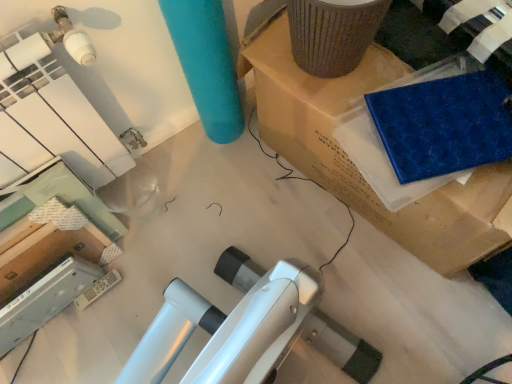
In order to face blue sponge at upper right, should I rotate leftwards or rightwards?

Rotate your view right by about 24.648°.

What do you see at coordinates (444, 124) in the screenshot? The image size is (512, 384). I see `blue sponge at upper right` at bounding box center [444, 124].

Where is `blue sponge at upper right`? blue sponge at upper right is located at coordinates (444, 124).

Measure the distance between point (x=333, y=154) and camera.

Point (x=333, y=154) and camera are 3.73 feet apart.

Locate an element on the screen. This screenshot has width=512, height=384. blue rubber mat at upper right is located at coordinates (352, 162).

Measure the distance between blue rubber mat at upper right and camera.

The depth of blue rubber mat at upper right is 34.29 inches.

What do you see at coordinates (352, 162) in the screenshot? This screenshot has height=384, width=512. I see `blue rubber mat at upper right` at bounding box center [352, 162].

Find the location of a particular element. Image resolution: width=512 pixels, height=384 pixels. blue sponge at upper right is located at coordinates (444, 124).

Which object is positioned more to the left, blue sponge at upper right or blue rubber mat at upper right?

blue sponge at upper right.

Considering the relative positions of blue sponge at upper right and blue rubber mat at upper right in the image provided, is blue sponge at upper right behind blue rubber mat at upper right?

Yes, blue sponge at upper right is further from the viewer.

Considering the points (482, 78) and (419, 213), which point is in front, point (482, 78) or point (419, 213)?

The point (482, 78) is more forward.

From the image's perspective, is blue sponge at upper right positioned above or below blue rubber mat at upper right?

blue sponge at upper right is situated lower than blue rubber mat at upper right in the image.

From a real-world perspective, which object rests below the other?

From a 3D spatial view, blue rubber mat at upper right is below.

Considering the sizes of blue sponge at upper right and blue rubber mat at upper right in the image, is blue sponge at upper right wider or thinner than blue rubber mat at upper right?

In the image, blue sponge at upper right appears to be more narrow than blue rubber mat at upper right.

Which of these two, blue sponge at upper right or blue rubber mat at upper right, stands taller?

Standing taller between the two is blue rubber mat at upper right.

Who is bigger, blue sponge at upper right or blue rubber mat at upper right?

blue rubber mat at upper right.

Choose the correct answer: Is blue sponge at upper right inside blue rubber mat at upper right or outside it?

blue sponge at upper right is located inside blue rubber mat at upper right.

In the scene shown: Is blue sponge at upper right directly adjacent to blue rubber mat at upper right?

They are not placed beside each other.

Is blue sponge at upper right looking in the opposite direction of blue rubber mat at upper right?

Yes, blue sponge at upper right is facing away from blue rubber mat at upper right.

Can you tell me how much blue sponge at upper right and blue rubber mat at upper right differ in facing direction?

blue sponge at upper right and blue rubber mat at upper right are facing 27.5 degrees away from each other.

Image resolution: width=512 pixels, height=384 pixels. What are the coordinates of `furniture below the blue sponge at upper right (from a real-world perspective)` in the screenshot? It's located at (352, 162).

Looking at this image, between blue rubber mat at upper right and blue sponge at upper right, which one appears on the right side from the viewer's perspective?

From the viewer's perspective, blue rubber mat at upper right appears more on the right side.

Is blue rubber mat at upper right further to camera compared to blue sponge at upper right?

No, blue rubber mat at upper right is closer to the viewer.

Which point is more distant from viewer, (446,196) or (431,113)?

The point (431,113) is farther from the camera.

Based on the photo, from the image's perspective, is blue rubber mat at upper right on blue sponge at upper right?

Yes, from the image's perspective, blue rubber mat at upper right is above blue sponge at upper right.

From a real-world perspective, is blue rubber mat at upper right positioned above or below blue sponge at upper right?

Clearly, from a real-world perspective, blue rubber mat at upper right is below blue sponge at upper right.

Which object is wider, blue rubber mat at upper right or blue sponge at upper right?

blue rubber mat at upper right is wider.

Considering the sizes of objects blue rubber mat at upper right and blue sponge at upper right in the image provided, who is taller, blue rubber mat at upper right or blue sponge at upper right?

Standing taller between the two is blue rubber mat at upper right.

Between blue rubber mat at upper right and blue sponge at upper right, which one has smaller size?

Smaller between the two is blue sponge at upper right.

Is blue rubber mat at upper right positioned beyond the bounds of blue sponge at upper right?

Yes, blue rubber mat at upper right is located beyond the bounds of blue sponge at upper right.

Is blue rubber mat at upper right with blue sponge at upper right?

They are not placed beside each other.

Is blue rubber mat at upper right facing towards blue sponge at upper right?

Yes, blue rubber mat at upper right is facing blue sponge at upper right.

At what (x,y) coordinates should I click in order to perform the action: click on furniture on the right of blue sponge at upper right. Please return your answer as a coordinate pair (x, y). Looking at the image, I should click on (352, 162).

The image size is (512, 384). What are the coordinates of `fabric above the blue rubber mat at upper right (from a real-world perspective)` in the screenshot? It's located at (444, 124).

Identify the location of fabric below the blue rubber mat at upper right (from the image's perspective). (444, 124).